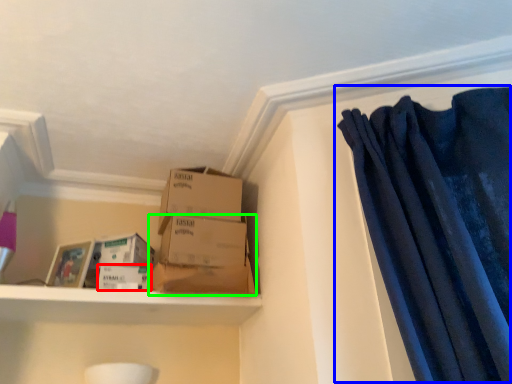
Question: Which is nearer to the storage box (highlighted by a red box)? curtain (highlighted by a blue box) or box (highlighted by a green box).

Choices:
 (A) curtain
 (B) box

Answer: (B)